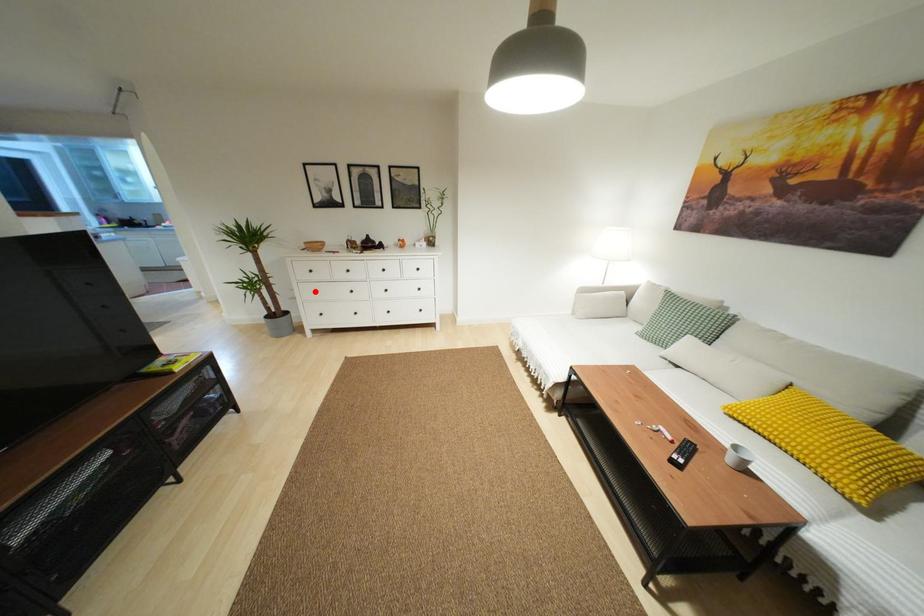
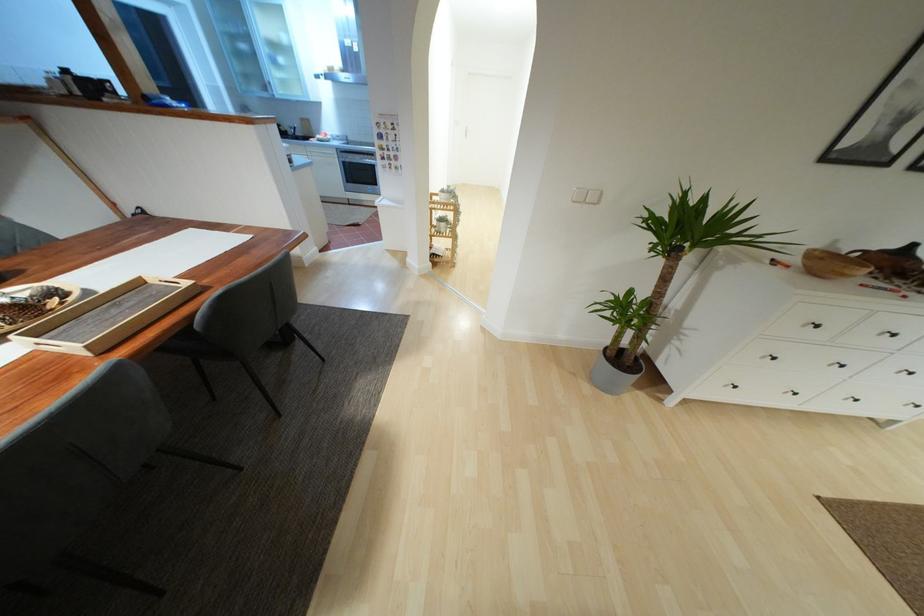
Where in the second image is the point corresponding to the highlighted location from the first image?

(773, 358)